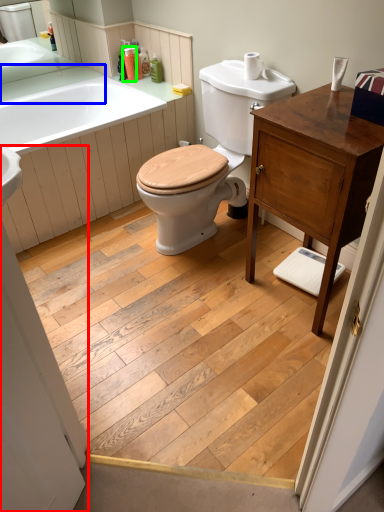
Question: Which object is the farthest from screen door (highlighted by a red box)? Choose among these: counter top (highlighted by a blue box) or toiletry (highlighted by a green box).

Choices:
 (A) counter top
 (B) toiletry

Answer: (B)